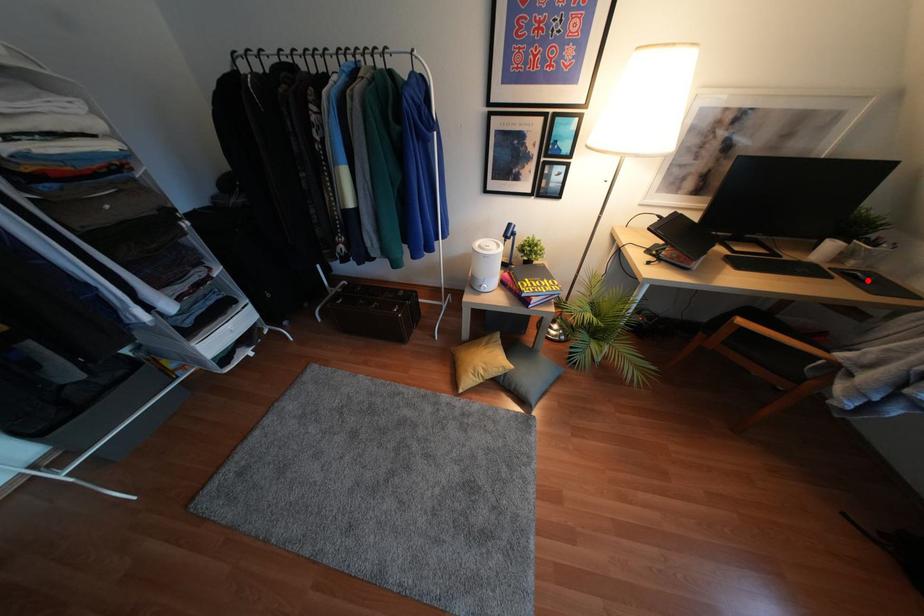
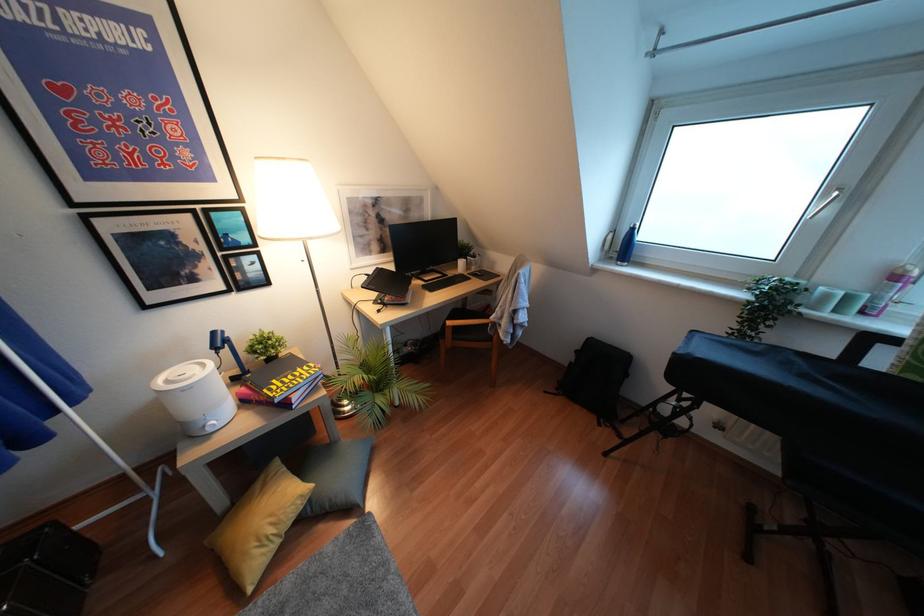
Where in the second image is the point corresponding to the highlighted location from the first image?

(481, 274)